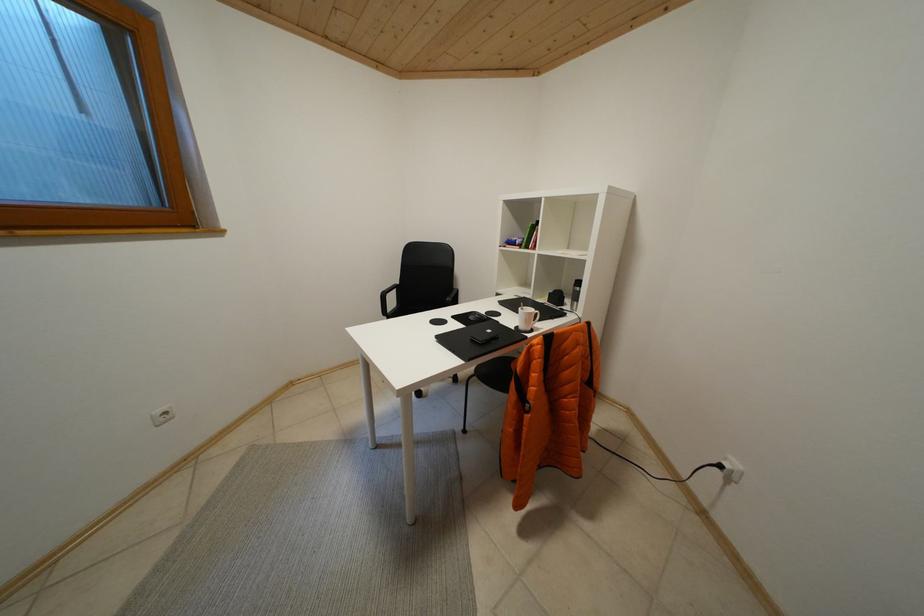
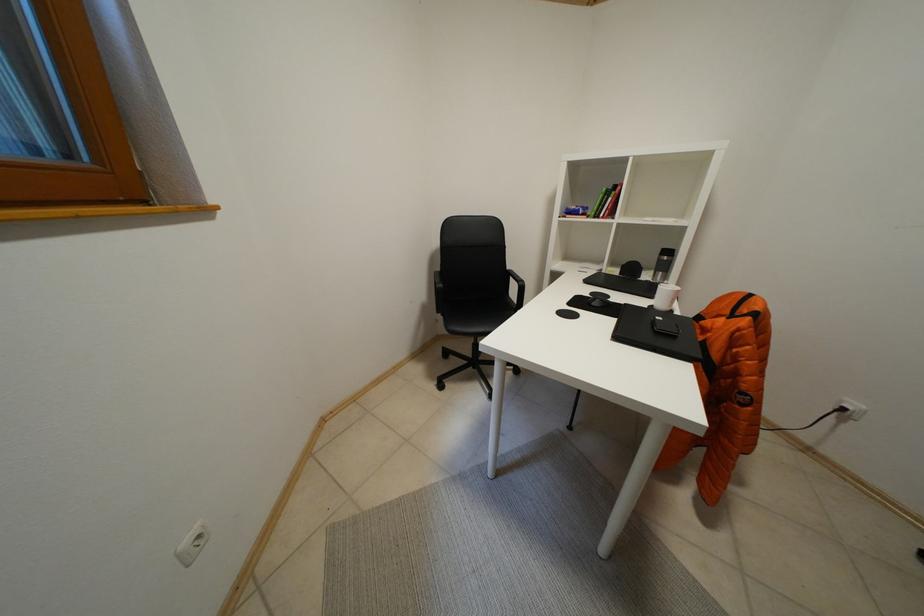
In a continuous first-person perspective shot, in which direction is the camera moving?

The movement direction of the cameraman is left, forward.